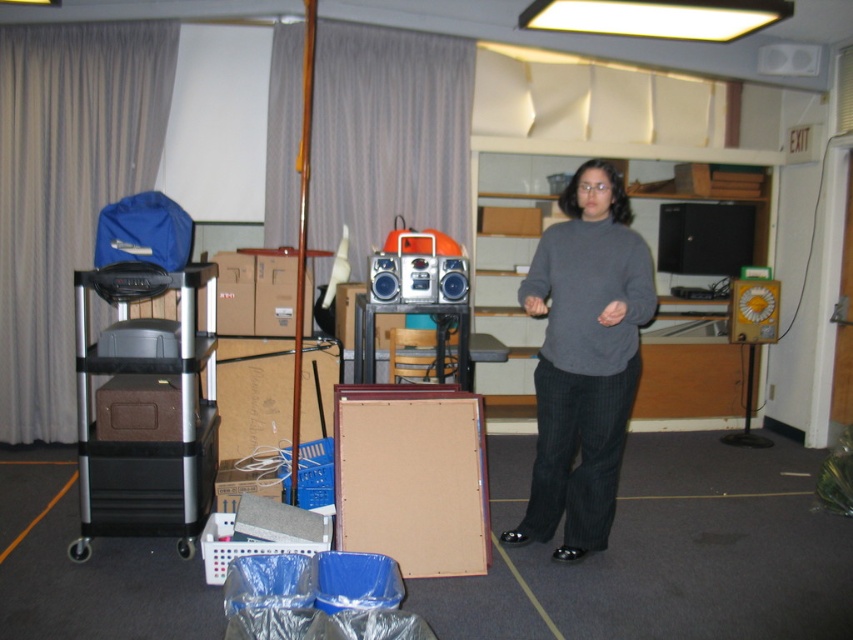
Question: Can you confirm if gray sweater at center is smaller than shiny silver radio at center?

Choices:
 (A) yes
 (B) no

Answer: (B)

Question: Does gray sweater at center appear on the left side of brown cardboard box at center?

Choices:
 (A) yes
 (B) no

Answer: (B)

Question: Does gray sweater at center have a greater width compared to brown cardboard box at center?

Choices:
 (A) yes
 (B) no

Answer: (B)

Question: Which point is closer to the camera?

Choices:
 (A) shiny silver radio at center
 (B) gray sweater at center
 (C) brown cardboard box at center
 (D) metallic silver cart at left

Answer: (B)

Question: Among these points, which one is nearest to the camera?

Choices:
 (A) (392, 294)
 (B) (631, 340)
 (C) (235, 396)

Answer: (B)

Question: Which object is farther from the camera taking this photo?

Choices:
 (A) metallic silver cart at left
 (B) shiny silver radio at center
 (C) gray sweater at center

Answer: (B)